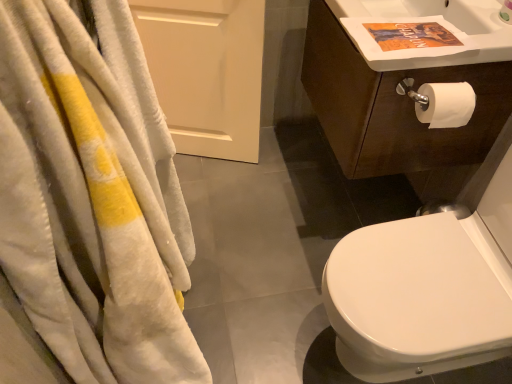
Question: Considering the positions of dark brown wood cabinet at upper right and white glossy bidet at right in the image, is dark brown wood cabinet at upper right bigger or smaller than white glossy bidet at right?

Choices:
 (A) big
 (B) small

Answer: (B)

Question: From a real-world perspective, is dark brown wood cabinet at upper right positioned above or below white glossy bidet at right?

Choices:
 (A) above
 (B) below

Answer: (A)

Question: Based on their relative distances, which object is nearer to the white matte door at upper left?

Choices:
 (A) white soft towel at left
 (B) white glossy sink at upper right
 (C) white glossy bidet at right
 (D) dark brown wood cabinet at upper right

Answer: (D)

Question: Estimate the real-world distances between objects in this image. Which object is farther from the white glossy bidet at right?

Choices:
 (A) white matte door at upper left
 (B) white soft towel at left
 (C) white glossy sink at upper right
 (D) dark brown wood cabinet at upper right

Answer: (A)